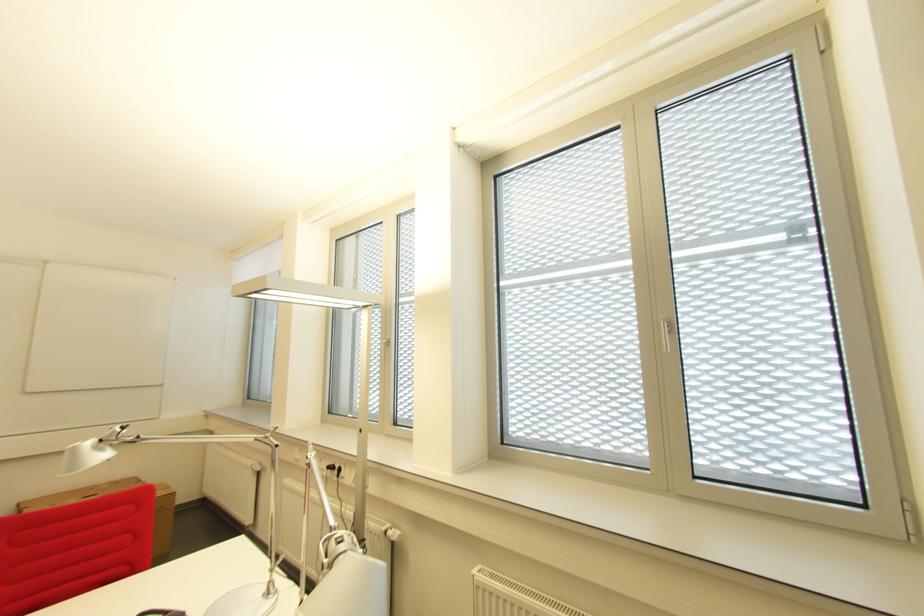
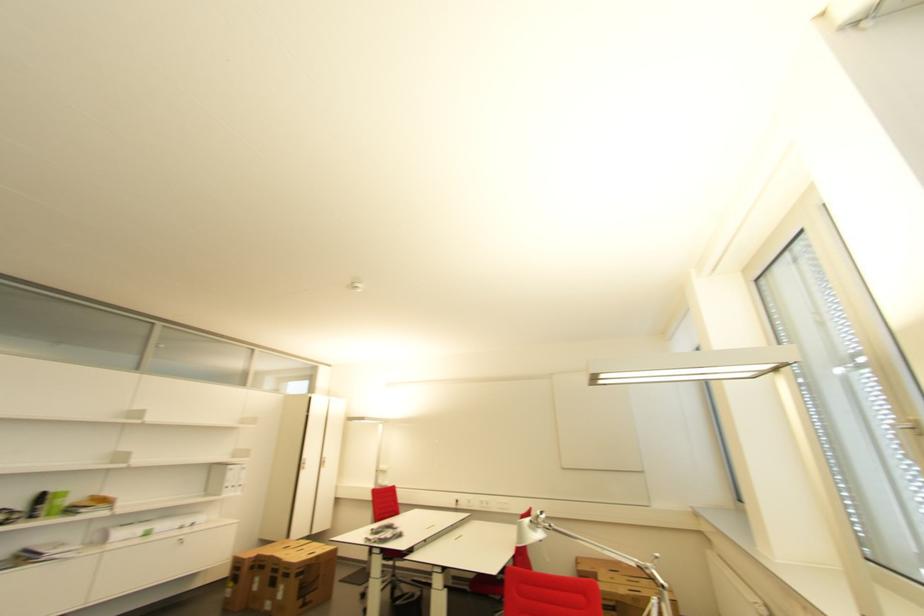
Based on the continuous images, in which direction is the camera rotating?

The rotation direction of the camera is left-up.